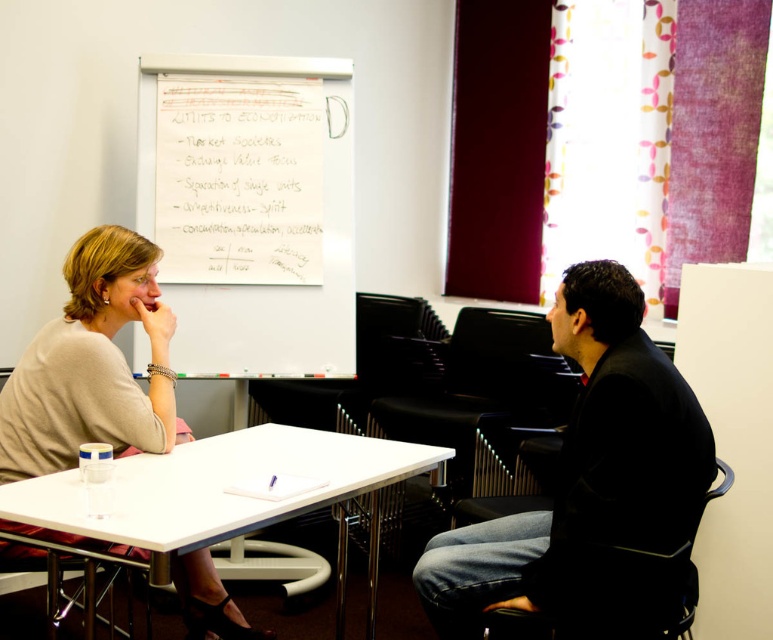
Consider the image. You are sitting in the conference room and want to hand a document to the person wearing the light beige sweater at center. The white plastic table at center is between you and them. Based on their positions, which side of the table should you approach to reach them?

The light beige sweater at center is to the left of the white plastic table at center, so you should approach the left side of the white plastic table at center to reach them.

What is located at the coordinates point (92, 364) in the image?

The coordinates point (92, 364) corresponds to the light beige sweater at center.

Looking at this image, you are standing at the point labeled point (257, 58) and want to walk towards the point labeled point (73, 460). Which direction should you face to move directly towards it?

To move directly from point (257, 58) to point (73, 460), you should face towards the southeast direction since point (73, 460) is located southeast of point (257, 58).